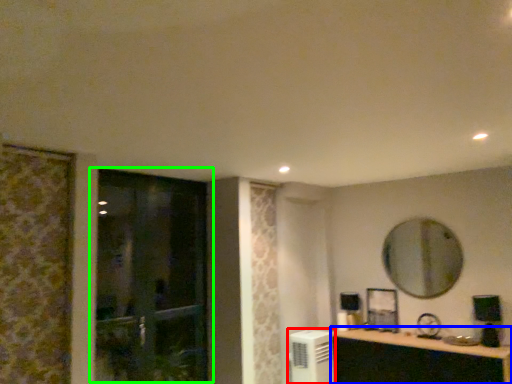
Question: Considering the real-world distances, which object is farthest from air conditioner (highlighted by a red box)? cabinetry (highlighted by a blue box) or door (highlighted by a green box)?

Choices:
 (A) cabinetry
 (B) door

Answer: (B)